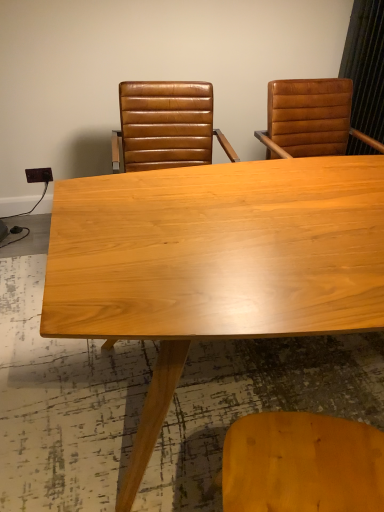
Find the location of a particular element. This screenshot has width=384, height=512. light wood table at center is located at coordinates point(252,188).

This screenshot has width=384, height=512. What do you see at coordinates (310, 119) in the screenshot?
I see `leather at right, the 1th chair when ordered from right to left` at bounding box center [310, 119].

You are a GUI agent. You are given a task and a screenshot of the screen. Output one action in this format:
    pyautogui.click(x=<x>, y=<y>)
    Task: Click on the leather at right, the 1th chair when ordered from right to left
    
    Given the screenshot: What is the action you would take?
    pyautogui.click(x=310, y=119)

Locate an element on the screen. light wood table at center is located at coordinates (252, 188).

Find the location of a particular element. The image size is (384, 512). the 2nd chair located above the light wood table at center (from a real-world perspective) is located at coordinates (310, 119).

Does light wood table at center have a larger size compared to leather at right, the 1th chair when ordered from right to left?

Yes, light wood table at center is bigger than leather at right, the 1th chair when ordered from right to left.

Considering the sizes of objects light wood table at center and leather at right, the second chair positioned from the left, in the image provided, who is thinner, light wood table at center or leather at right, the second chair positioned from the left,?

leather at right, the second chair positioned from the left, is thinner.

Who is more distant, light wood table at center or leather at right, the 1th chair when ordered from right to left?

leather at right, the 1th chair when ordered from right to left.

Is brown leather chair at upper center, which ranks as the 2th chair in right-to-left order, facing away from leather at right, the 1th chair when ordered from right to left?

No, brown leather chair at upper center, which ranks as the 2th chair in right-to-left order, is not facing the opposite direction of leather at right, the 1th chair when ordered from right to left.

Looking at this image, from a real-world perspective, is brown leather chair at upper center, which ranks as the 2th chair in right-to-left order, positioned over leather at right, the 1th chair when ordered from right to left, based on gravity?

Actually, brown leather chair at upper center, which ranks as the 2th chair in right-to-left order, is physically below leather at right, the 1th chair when ordered from right to left, in the real world.

Is brown leather chair at upper center, which ranks as the 2th chair in right-to-left order, bigger or smaller than leather at right, the 1th chair when ordered from right to left?

brown leather chair at upper center, which ranks as the 2th chair in right-to-left order, is smaller than leather at right, the 1th chair when ordered from right to left.

From the image's perspective, between brown leather chair at upper center, which ranks as the 2th chair in right-to-left order, and leather at right, the second chair positioned from the left, which one is located above?

leather at right, the second chair positioned from the left, appears higher in the image.

Is brown leather chair at upper center, which ranks as the 2th chair in right-to-left order, looking in the opposite direction of light wood table at center?

No, brown leather chair at upper center, which ranks as the 2th chair in right-to-left order, is not facing away from light wood table at center.

From the image's perspective, is brown leather chair at upper center, which appears as the first chair when viewed from the left, located above light wood table at center?

Yes, from the image's perspective, brown leather chair at upper center, which appears as the first chair when viewed from the left, is on top of light wood table at center.

Considering the relative positions of brown leather chair at upper center, which appears as the first chair when viewed from the left, and light wood table at center in the image provided, is brown leather chair at upper center, which appears as the first chair when viewed from the left, to the right of light wood table at center from the viewer's perspective?

No, brown leather chair at upper center, which appears as the first chair when viewed from the left, is not to the right of light wood table at center.

Find the location of a particular element. chair on the left of light wood table at center is located at coordinates (166, 126).

Who is bigger, leather at right, the second chair positioned from the left, or light wood table at center?

With larger size is light wood table at center.

Is the surface of leather at right, the 1th chair when ordered from right to left, in direct contact with light wood table at center?

No, leather at right, the 1th chair when ordered from right to left, is not beside light wood table at center.

Is leather at right, the second chair positioned from the left, wider than light wood table at center?

No.

Can you confirm if leather at right, the 1th chair when ordered from right to left, is shorter than light wood table at center?

Indeed, leather at right, the 1th chair when ordered from right to left, has a lesser height compared to light wood table at center.

Could you tell me if leather at right, the 1th chair when ordered from right to left, is facing brown leather chair at upper center, which appears as the first chair when viewed from the left?

No, leather at right, the 1th chair when ordered from right to left, does not turn towards brown leather chair at upper center, which appears as the first chair when viewed from the left.

In terms of width, does leather at right, the second chair positioned from the left, look wider or thinner when compared to brown leather chair at upper center, which appears as the first chair when viewed from the left?

leather at right, the second chair positioned from the left, is wider than brown leather chair at upper center, which appears as the first chair when viewed from the left.

From a real-world perspective, who is located lower, leather at right, the second chair positioned from the left, or brown leather chair at upper center, which ranks as the 2th chair in right-to-left order?

brown leather chair at upper center, which ranks as the 2th chair in right-to-left order, is physically lower.

Is leather at right, the second chair positioned from the left, outside of brown leather chair at upper center, which ranks as the 2th chair in right-to-left order?

Indeed, leather at right, the second chair positioned from the left, is completely outside brown leather chair at upper center, which ranks as the 2th chair in right-to-left order.

Identify the location of chair lying on the left of light wood table at center. (166, 126).

Looking at this image, between light wood table at center and brown leather chair at upper center, which appears as the first chair when viewed from the left, which one is positioned behind?

brown leather chair at upper center, which appears as the first chair when viewed from the left, is further from the camera.

Does light wood table at center have a larger size compared to brown leather chair at upper center, which appears as the first chair when viewed from the left?

Correct, light wood table at center is larger in size than brown leather chair at upper center, which appears as the first chair when viewed from the left.

Looking at their sizes, would you say light wood table at center is wider or thinner than brown leather chair at upper center, which appears as the first chair when viewed from the left?

Considering their sizes, light wood table at center looks broader than brown leather chair at upper center, which appears as the first chair when viewed from the left.

Where is `table in front of the leather at right, the 1th chair when ordered from right to left`? This screenshot has height=512, width=384. table in front of the leather at right, the 1th chair when ordered from right to left is located at coordinates (252, 188).

The height and width of the screenshot is (512, 384). Identify the location of chair below the leather at right, the 1th chair when ordered from right to left (from a real-world perspective). (166, 126).

From the image, which object appears to be farther from leather at right, the 1th chair when ordered from right to left, light wood table at center or brown leather chair at upper center, which appears as the first chair when viewed from the left?

light wood table at center is positioned further to the anchor leather at right, the 1th chair when ordered from right to left.

Looking at the image, which one is located further to light wood table at center, leather at right, the 1th chair when ordered from right to left, or brown leather chair at upper center, which appears as the first chair when viewed from the left?

leather at right, the 1th chair when ordered from right to left, is positioned further to the anchor light wood table at center.

Based on their spatial positions, is brown leather chair at upper center, which ranks as the 2th chair in right-to-left order, or light wood table at center further from leather at right, the 1th chair when ordered from right to left?

Based on the image, light wood table at center appears to be further to leather at right, the 1th chair when ordered from right to left.

From the picture: Considering their positions, is light wood table at center positioned closer to brown leather chair at upper center, which appears as the first chair when viewed from the left, than leather at right, the 1th chair when ordered from right to left?

leather at right, the 1th chair when ordered from right to left, lies closer to brown leather chair at upper center, which appears as the first chair when viewed from the left, than the other object.

Based on their spatial positions, is brown leather chair at upper center, which ranks as the 2th chair in right-to-left order, or leather at right, the 1th chair when ordered from right to left, further from light wood table at center?

leather at right, the 1th chair when ordered from right to left.

Looking at the image, which one is located closer to brown leather chair at upper center, which ranks as the 2th chair in right-to-left order, leather at right, the second chair positioned from the left, or light wood table at center?

Based on the image, leather at right, the second chair positioned from the left, appears to be nearer to brown leather chair at upper center, which ranks as the 2th chair in right-to-left order.

Where is `chair between light wood table at center and leather at right, the second chair positioned from the left, along the z-axis`? chair between light wood table at center and leather at right, the second chair positioned from the left, along the z-axis is located at coordinates (166, 126).